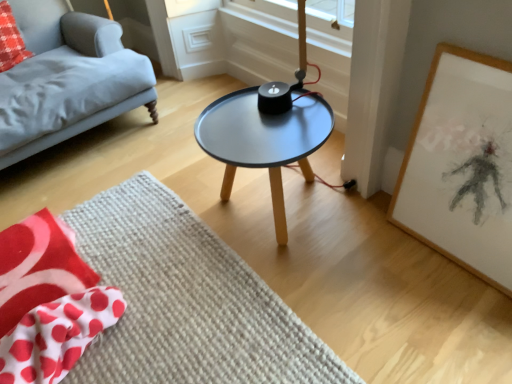
Question: From the image's perspective, is beige textured mat at center located above or below red polka dot fabric at upper left?

Choices:
 (A) below
 (B) above

Answer: (A)

Question: Considering the positions of beige textured mat at center and red polka dot fabric at upper left in the image, is beige textured mat at center bigger or smaller than red polka dot fabric at upper left?

Choices:
 (A) big
 (B) small

Answer: (A)

Question: Which is farther from the beige textured mat at center?

Choices:
 (A) matte gray fabric couch at left
 (B) white paper with charcoal drawing at right
 (C) matte black table at center
 (D) red polka dot fabric at lower left
 (E) red polka dot fabric at upper left

Answer: (E)

Question: Estimate the real-world distances between objects in this image. Which object is closer to the white paper with charcoal drawing at right?

Choices:
 (A) matte black table at center
 (B) red polka dot fabric at lower left
 (C) red polka dot fabric at upper left
 (D) matte gray fabric couch at left
 (E) beige textured mat at center

Answer: (A)